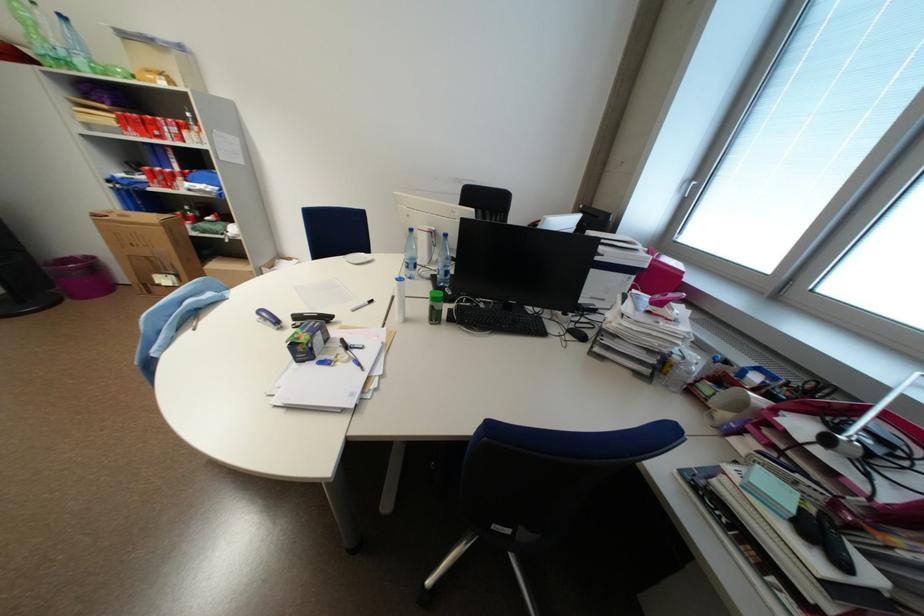
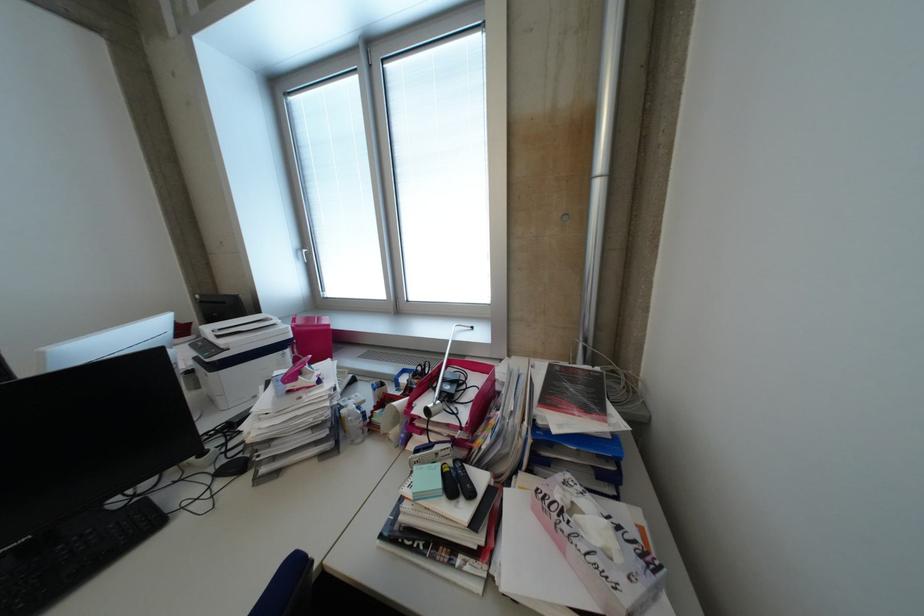
Find the pixel in the second image that matches pixel 822 532 in the first image.

(464, 485)